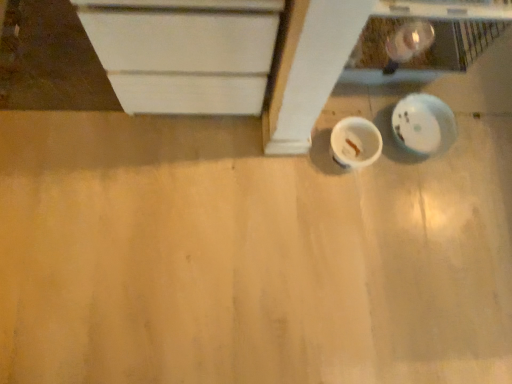
Find the location of `vacant area that lies to the right of white matte cup at center`. vacant area that lies to the right of white matte cup at center is located at coordinates pos(408,183).